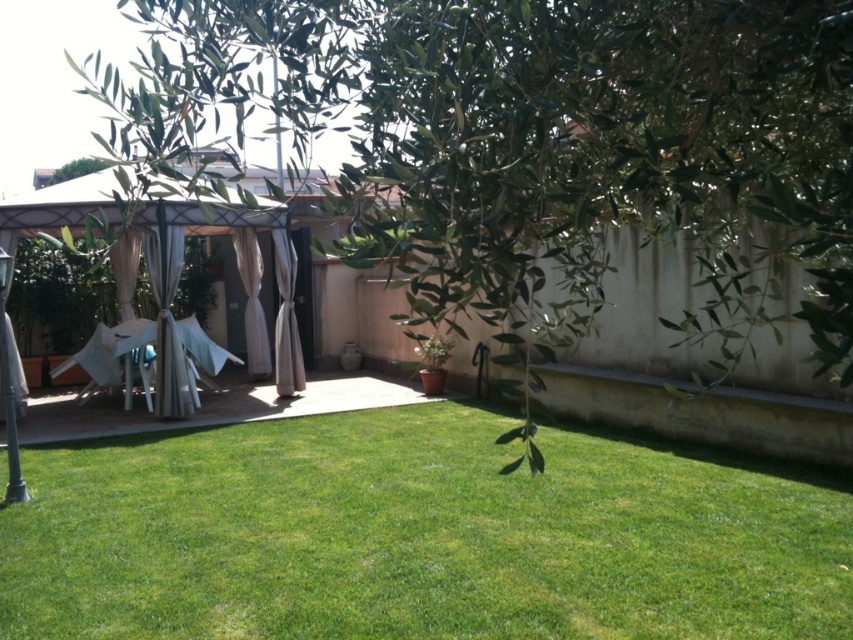
Question: Does green leafy tree at upper center appear over green grass at center?

Choices:
 (A) no
 (B) yes

Answer: (B)

Question: Is green leafy tree at upper center below green grass at center?

Choices:
 (A) no
 (B) yes

Answer: (A)

Question: Is green leafy tree at upper center smaller than green grass at center?

Choices:
 (A) no
 (B) yes

Answer: (A)

Question: Among these points, which one is nearest to the camera?

Choices:
 (A) (633, 29)
 (B) (253, 524)

Answer: (A)

Question: Which of the following is the farthest from the observer?

Choices:
 (A) (735, 61)
 (B) (697, 506)

Answer: (B)